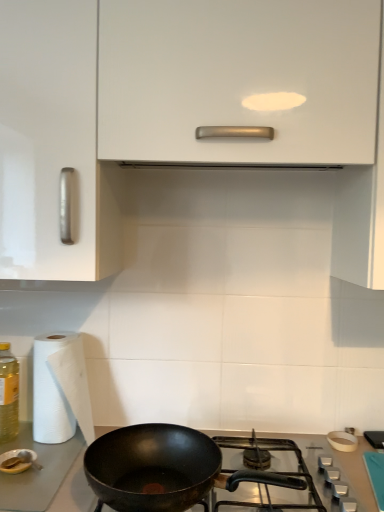
Question: Is black matte pan at lower center bigger than white paper at left?

Choices:
 (A) yes
 (B) no

Answer: (A)

Question: From the image's perspective, would you say black matte pan at lower center is positioned over white paper at left?

Choices:
 (A) no
 (B) yes

Answer: (A)

Question: Can you confirm if black matte pan at lower center is shorter than white paper at left?

Choices:
 (A) no
 (B) yes

Answer: (B)

Question: Is black matte pan at lower center smaller than white paper at left?

Choices:
 (A) no
 (B) yes

Answer: (A)

Question: Is white paper at left at the back of black matte pan at lower center?

Choices:
 (A) yes
 (B) no

Answer: (B)

Question: Looking at their shapes, would you say translucent yellow bottle at left is wider or thinner than white paper at left?

Choices:
 (A) thin
 (B) wide

Answer: (A)

Question: Visually, is translucent yellow bottle at left positioned to the left or to the right of white paper at left?

Choices:
 (A) right
 (B) left

Answer: (B)

Question: Based on their sizes in the image, would you say translucent yellow bottle at left is bigger or smaller than white paper at left?

Choices:
 (A) big
 (B) small

Answer: (B)

Question: Is translucent yellow bottle at left in front of or behind white paper at left in the image?

Choices:
 (A) behind
 (B) front

Answer: (A)

Question: From the image's perspective, is white glossy cabinet at upper center above or below white paper at left?

Choices:
 (A) below
 (B) above

Answer: (B)

Question: From their relative heights in the image, would you say white glossy cabinet at upper center is taller or shorter than white paper at left?

Choices:
 (A) tall
 (B) short

Answer: (A)

Question: Considering their positions, is white glossy cabinet at upper center located in front of or behind white paper at left?

Choices:
 (A) behind
 (B) front

Answer: (B)

Question: Is white glossy cabinet at upper center to the left or to the right of white paper at left in the image?

Choices:
 (A) left
 (B) right

Answer: (B)

Question: Which is correct: white paper at left is inside translucent yellow bottle at left, or outside of it?

Choices:
 (A) outside
 (B) inside

Answer: (A)

Question: Relative to translucent yellow bottle at left, is white paper at left in front or behind?

Choices:
 (A) front
 (B) behind

Answer: (A)